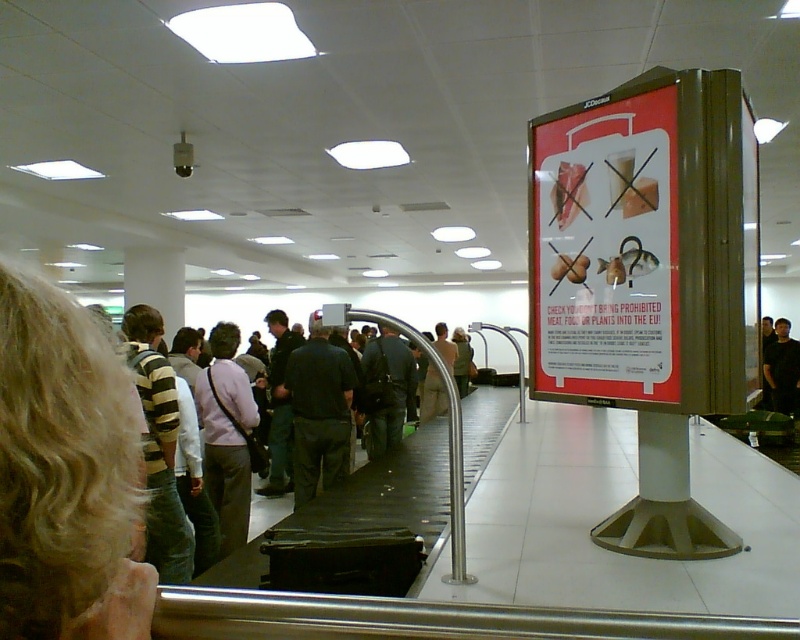
You are an airport security agent inspecting items on the conveyor belt. You notice a black cotton shirt at center and a light brown fabric jacket at center. Which item is positioned higher on the conveyor belt?

The black cotton shirt at center is above the light brown fabric jacket at center, so the black cotton shirt at center is positioned higher on the conveyor belt.

You are a traveler standing in the baggage claim area and notice two items of interest. One is a person with blonde hair at upper left, and the other is a matte plastic sign at upper right. Based on their positions, which one would you look at first if you were facing the conveyor belt directly?

The blonde hair at upper left would be seen first because it is positioned to the left of the matte plastic sign at upper right when facing the conveyor belt directly.